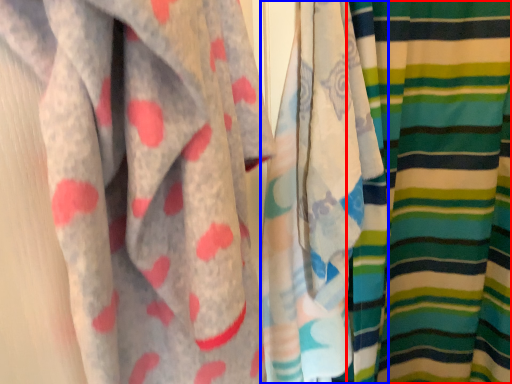
Question: Which of the following is the farthest to the observer, curtain (highlighted by a red box) or curtain (highlighted by a blue box)?

Choices:
 (A) curtain
 (B) curtain

Answer: (A)